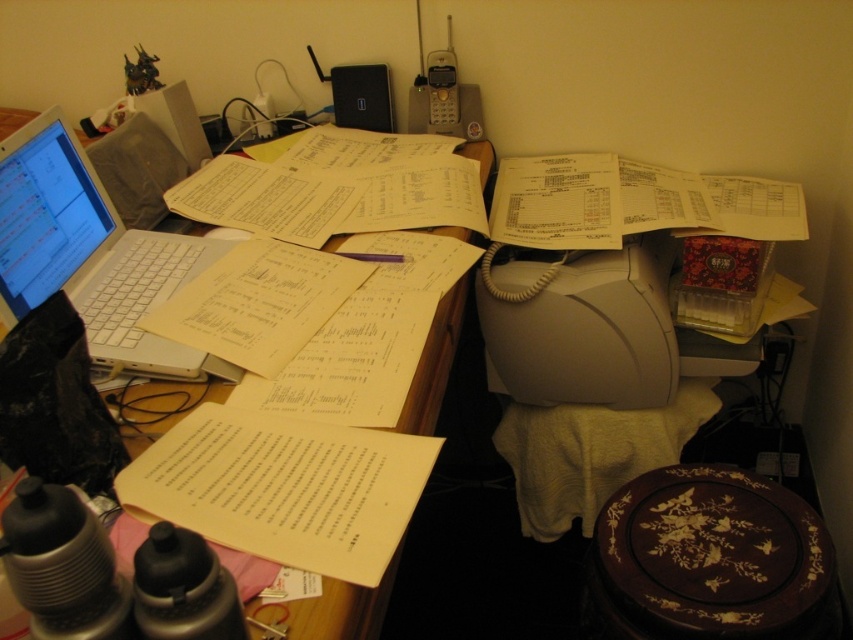
You are organizing items on a desk and need to place a new item between the wooden plate with inlaid design at lower right and the wooden at left. Which side should you place it closer to, the narrower object or the wider one?

The wooden plate with inlaid design at lower right is narrower than the wooden at left, so you should place the new item closer to the wider wooden at left to balance the arrangement.

You are standing 30 inches away from the desk. Is the point at coordinates point [140,356] on the desk within your reach?

The distance of point [140,356] from viewer is 31.69 inches, which is slightly beyond your current position at 30 inches. Therefore, you cannot reach the point at point 0.558, 0.558 on the desk.